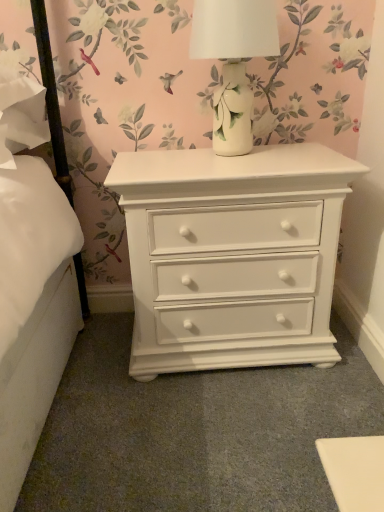
Question: Is white painted wood nightstand at center completely or partially outside of white ceramic vase at upper center?

Choices:
 (A) yes
 (B) no

Answer: (A)

Question: Is white painted wood nightstand at center further to camera compared to white ceramic vase at upper center?

Choices:
 (A) yes
 (B) no

Answer: (A)

Question: Is white painted wood nightstand at center facing away from white ceramic vase at upper center?

Choices:
 (A) yes
 (B) no

Answer: (B)

Question: From a real-world perspective, is white painted wood nightstand at center over white ceramic vase at upper center?

Choices:
 (A) no
 (B) yes

Answer: (A)

Question: From the image's perspective, would you say white painted wood nightstand at center is positioned over white ceramic vase at upper center?

Choices:
 (A) yes
 (B) no

Answer: (B)

Question: Does white painted wood nightstand at center come in front of white ceramic vase at upper center?

Choices:
 (A) no
 (B) yes

Answer: (A)

Question: From the image's perspective, would you say white ceramic vase at upper center is shown under white painted wood nightstand at center?

Choices:
 (A) no
 (B) yes

Answer: (A)

Question: From a real-world perspective, is white ceramic vase at upper center below white painted wood nightstand at center?

Choices:
 (A) yes
 (B) no

Answer: (B)

Question: Does white ceramic vase at upper center have a greater height compared to white painted wood nightstand at center?

Choices:
 (A) no
 (B) yes

Answer: (A)

Question: Is white ceramic vase at upper center facing towards white painted wood nightstand at center?

Choices:
 (A) no
 (B) yes

Answer: (A)

Question: Does white ceramic vase at upper center have a larger size compared to white painted wood nightstand at center?

Choices:
 (A) no
 (B) yes

Answer: (A)

Question: Considering the relative positions of white ceramic vase at upper center and white painted wood nightstand at center in the image provided, is white ceramic vase at upper center behind white painted wood nightstand at center?

Choices:
 (A) yes
 (B) no

Answer: (B)

Question: In terms of width, does white ceramic vase at upper center look wider or thinner when compared to white painted wood nightstand at center?

Choices:
 (A) thin
 (B) wide

Answer: (A)